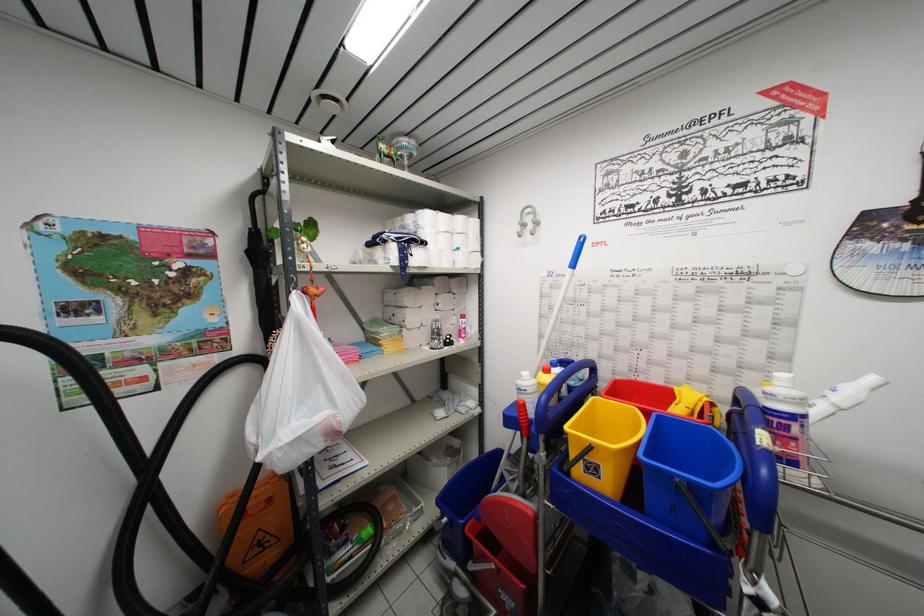
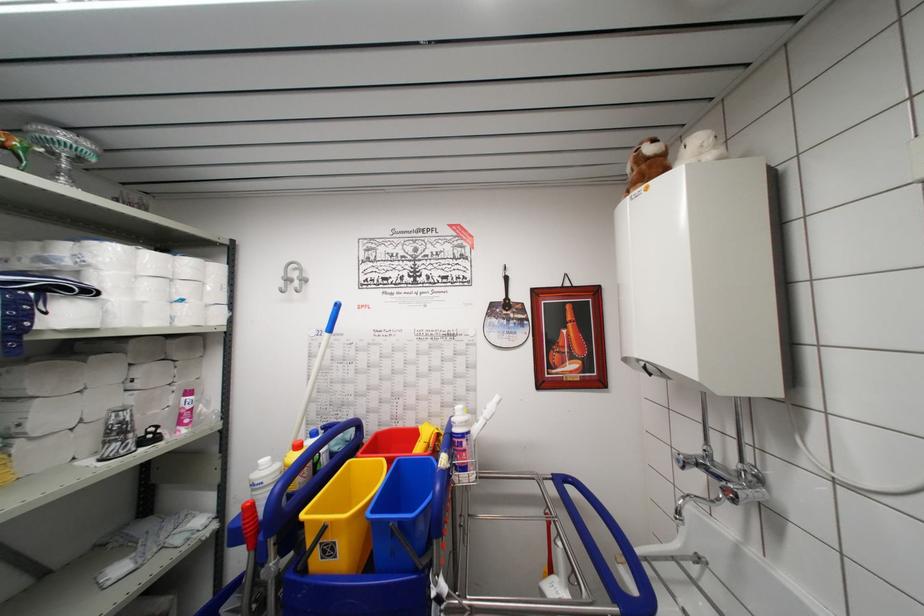
Locate, in the second image, the point that corresponds to point (783, 428) in the first image.

(460, 447)